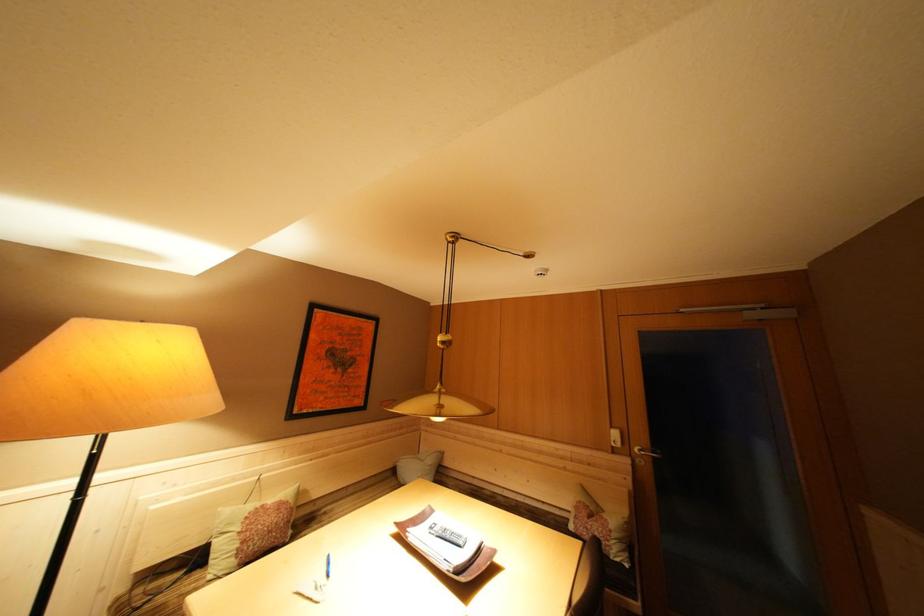
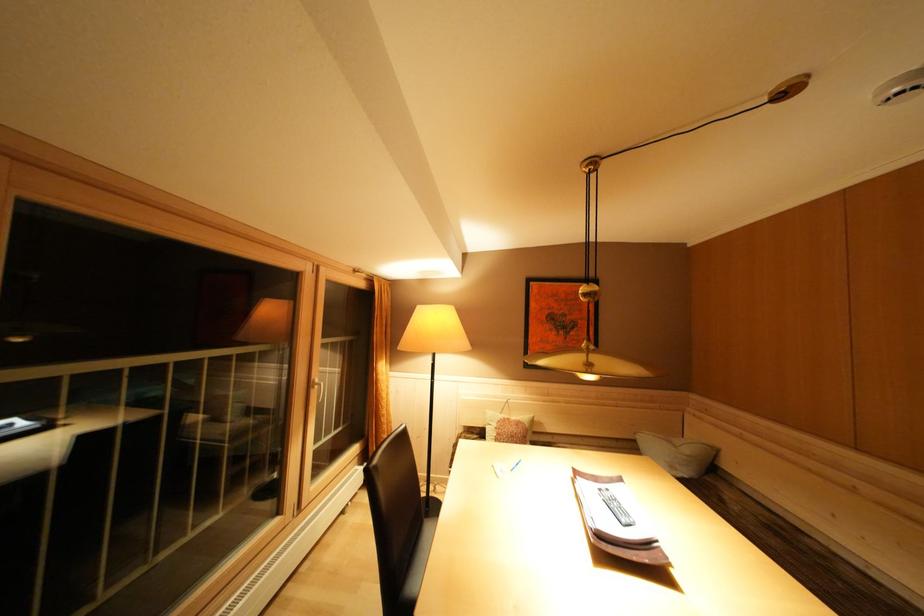
The point at (455,480) is marked in the first image. Where is the corresponding point in the second image?

(737, 490)